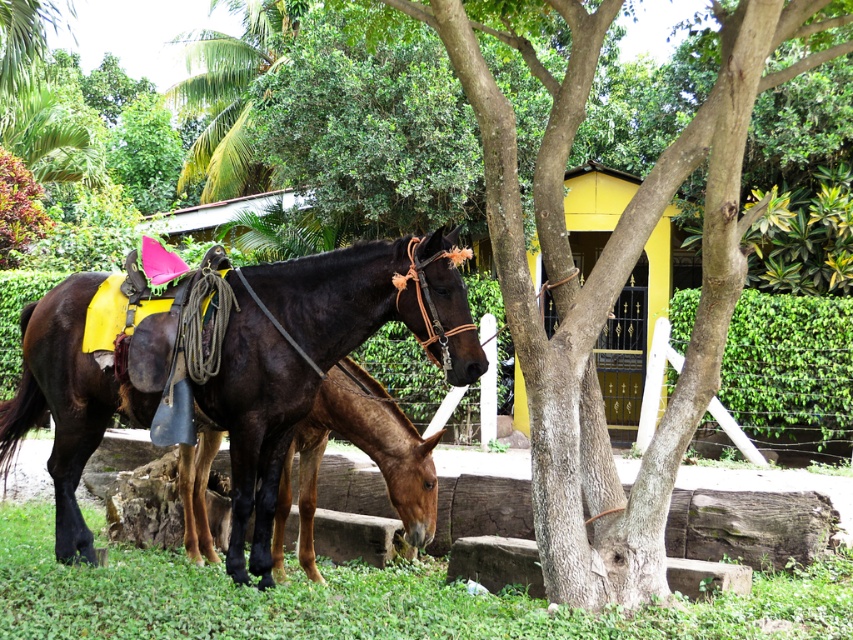
Question: Does shiny dark brown horse at center appear on the left side of brown glossy horse at center?

Choices:
 (A) yes
 (B) no

Answer: (A)

Question: Can you confirm if shiny dark brown horse at center is positioned below brown glossy horse at center?

Choices:
 (A) yes
 (B) no

Answer: (B)

Question: Which point is closer to the camera?

Choices:
 (A) shiny dark brown horse at center
 (B) brown glossy horse at center

Answer: (A)

Question: Observing the image, what is the correct spatial positioning of shiny dark brown horse at center in reference to brown glossy horse at center?

Choices:
 (A) left
 (B) right

Answer: (A)